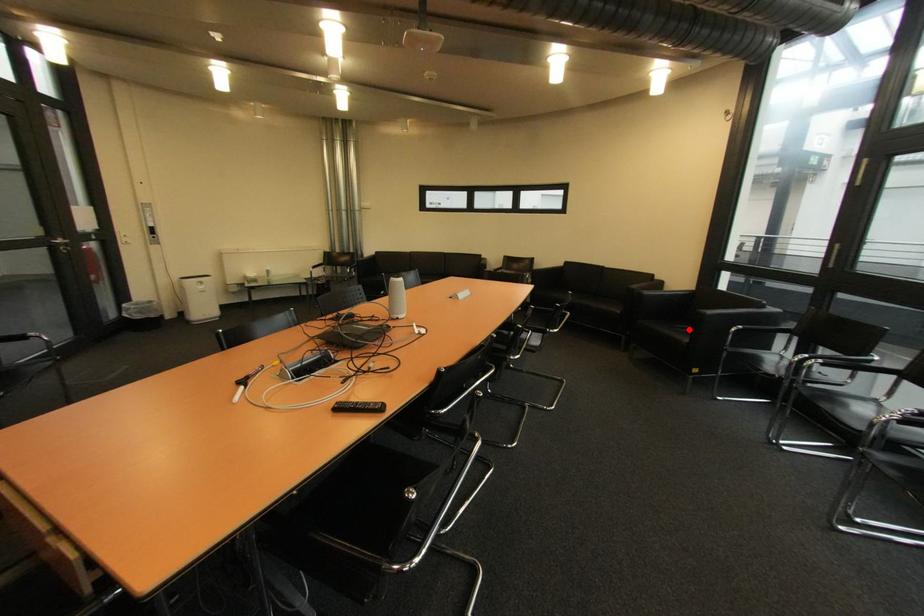
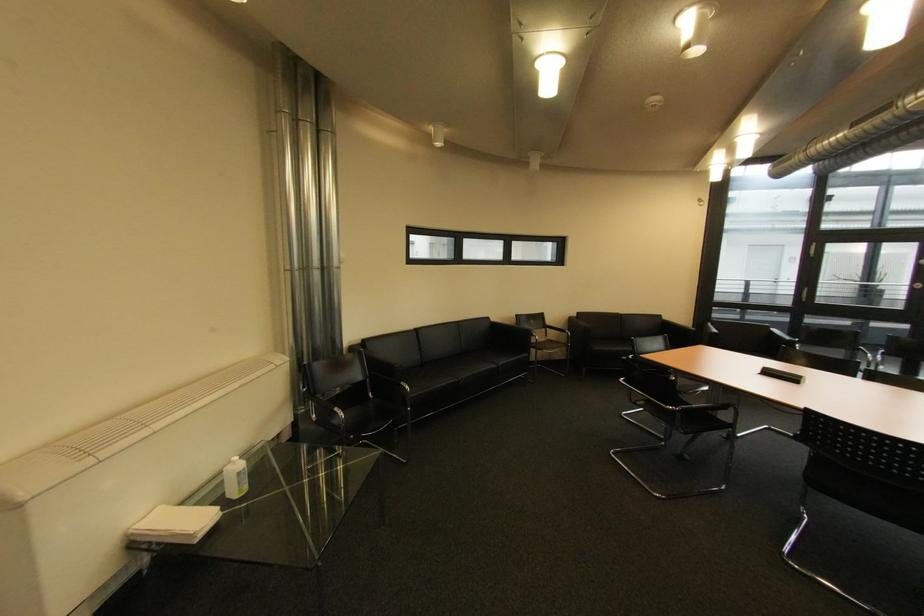
Question: I am providing you with two images of the same scene from different viewpoints. A red point is marked on the first image. Can you still see the location of the red point in image 2?

Choices:
 (A) Yes
 (B) No

Answer: (B)